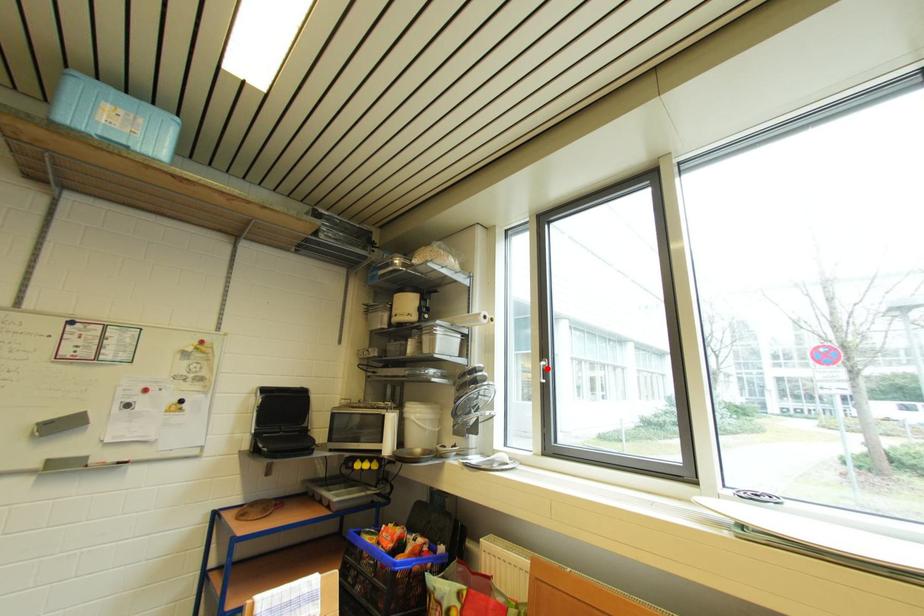
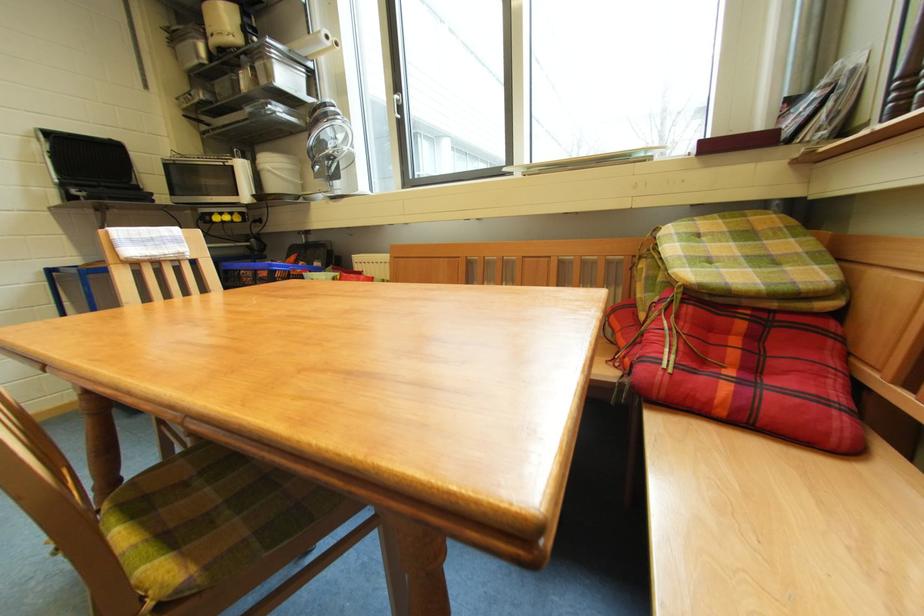
Question: I am providing you with two images of the same scene from different viewpoints. Given a red point in image1, look at the same physical point in image2. Is it:

Choices:
 (A) Closer to the viewpoint
 (B) Farther from the viewpoint

Answer: (A)